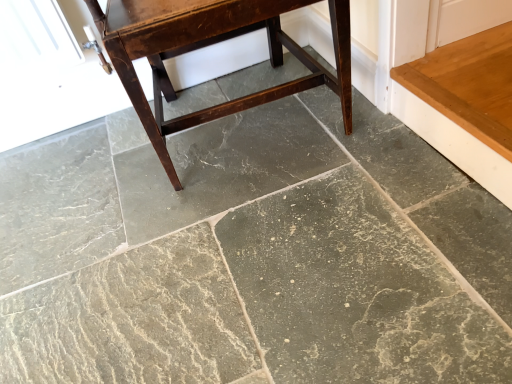
The image size is (512, 384). I want to click on free space to the left of dark brown wood table at center, so click(88, 185).